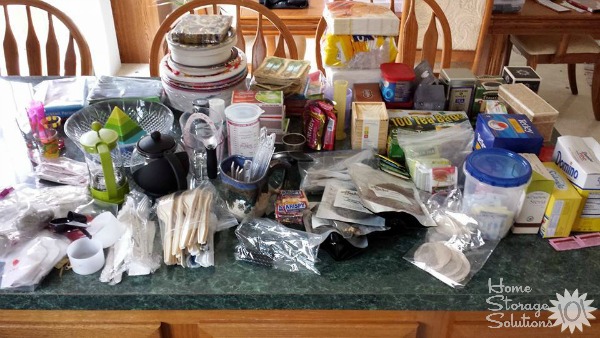
You are a GUI agent. You are given a task and a screenshot of the screen. Output one action in this format:
    pyautogui.click(x=<x>, y=<y>)
    Task: Click on the spoon
    
    Given the screenshot: What is the action you would take?
    pyautogui.click(x=184, y=225)